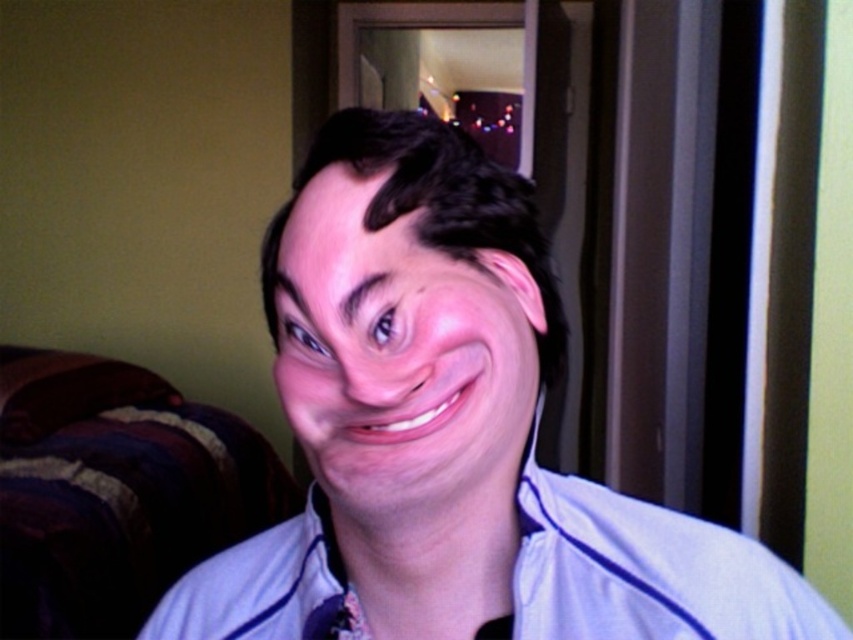
You are a fashion designer trying to decide which shirt to feature in your collection. You have two options in front of you, the blue fabric shirt at center and the light blue fabric dress shirt at center. Based on the image, which one is larger?

The blue fabric shirt at center is bigger than the light blue fabric dress shirt at center, so the blue fabric shirt at center is the larger one.

You are a photographer adjusting your camera settings to capture a portrait. The subject is wearing a blue fabric shirt at center. To ensure the shirt is in focus, what distance should you set your camera lens to?

The blue fabric shirt at center is 11.49 inches from camera, so you should set the camera lens to focus at 11.49 inches to ensure the shirt is in focus.